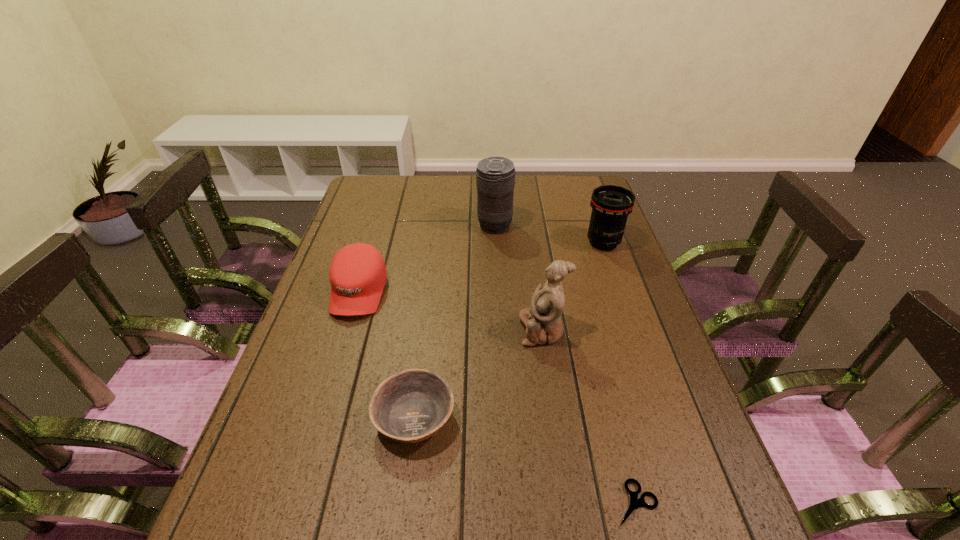
Locate an element on the screen. free point between the third shortest object and the figurine is located at coordinates (450, 311).

What are the coordinates of `free space between the second nearest object and the shortest object` in the screenshot? It's located at (525, 460).

The image size is (960, 540). Identify the location of free space between the taller telephoto lens and the second shortest object. (454, 322).

At what (x,y) coordinates should I click in order to perform the action: click on free space between the figurine and the fifth object from right to left. Please return your answer as a coordinate pair (x, y). The width and height of the screenshot is (960, 540). Looking at the image, I should click on (478, 374).

Identify the location of free spot between the right telephoto lens and the taller telephoto lens. (549, 234).

The height and width of the screenshot is (540, 960). In order to click on free space between the nearest object and the fourth shortest object in this screenshot , I will do `click(619, 373)`.

Where is `blank region between the shortest object and the right telephoto lens`? This screenshot has height=540, width=960. blank region between the shortest object and the right telephoto lens is located at coordinates (619, 373).

Identify which object is the closest to the right telephoto lens. Please provide its 2D coordinates. Your answer should be formatted as a tuple, i.e. [(x, y)], where the tuple contains the x and y coordinates of a point satisfying the conditions above.

[(495, 176)]

Locate an element on the screen. The width and height of the screenshot is (960, 540). the fifth closest object to the fifth tallest object is located at coordinates (611, 205).

This screenshot has width=960, height=540. Find the location of `free space that satisfies the following two spatial constraints: 1. on the side of the left telephoto lens where the control switches are located; 2. on the left side of the shortest object`. free space that satisfies the following two spatial constraints: 1. on the side of the left telephoto lens where the control switches are located; 2. on the left side of the shortest object is located at coordinates (506, 503).